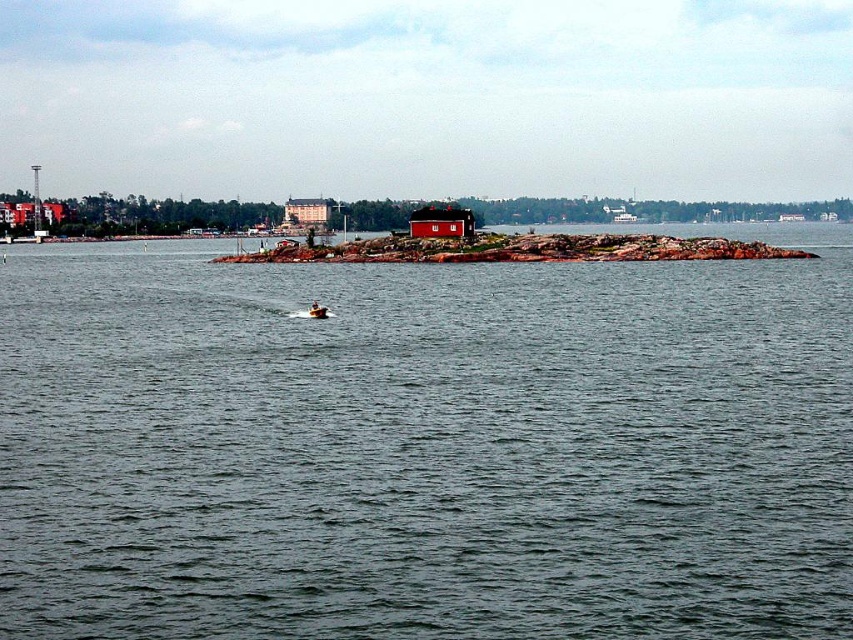
Question: Is greenish water at center positioned in front of red matte house at center?

Choices:
 (A) yes
 (B) no

Answer: (A)

Question: Which point is farther to the camera?

Choices:
 (A) red matte house at center
 (B) red stone island at center

Answer: (A)

Question: Can you confirm if greenish water at center is positioned above red stone island at center?

Choices:
 (A) no
 (B) yes

Answer: (A)

Question: Which of the following is the closest to the observer?

Choices:
 (A) (428, 228)
 (B) (180, 486)
 (C) (328, 307)

Answer: (B)

Question: From the image, what is the correct spatial relationship of greenish water at center in relation to red matte house at center?

Choices:
 (A) below
 (B) above

Answer: (A)

Question: Which point is closer to the camera?

Choices:
 (A) red matte house at center
 (B) orange fiberglass boat at center

Answer: (B)